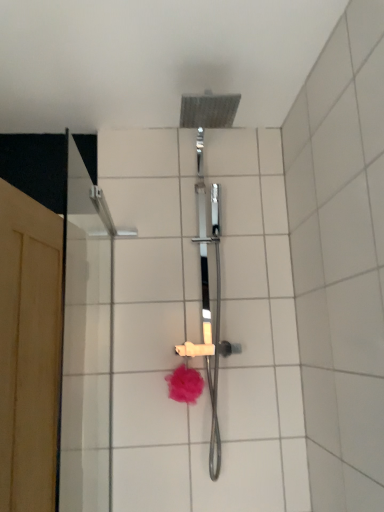
Question: Is pink fluffy bath puff at center situated inside white ceramic tile at upper center or outside?

Choices:
 (A) outside
 (B) inside

Answer: (A)

Question: From a real-world perspective, is pink fluffy bath puff at center positioned above or below white ceramic tile at upper center?

Choices:
 (A) below
 (B) above

Answer: (A)

Question: Which object is the closest to the wooden screen door at left?

Choices:
 (A) pink fluffy bath puff at center
 (B) white ceramic tile at upper center

Answer: (A)

Question: Which object is positioned farthest from the wooden screen door at left?

Choices:
 (A) pink fluffy bath puff at center
 (B) white ceramic tile at upper center

Answer: (B)